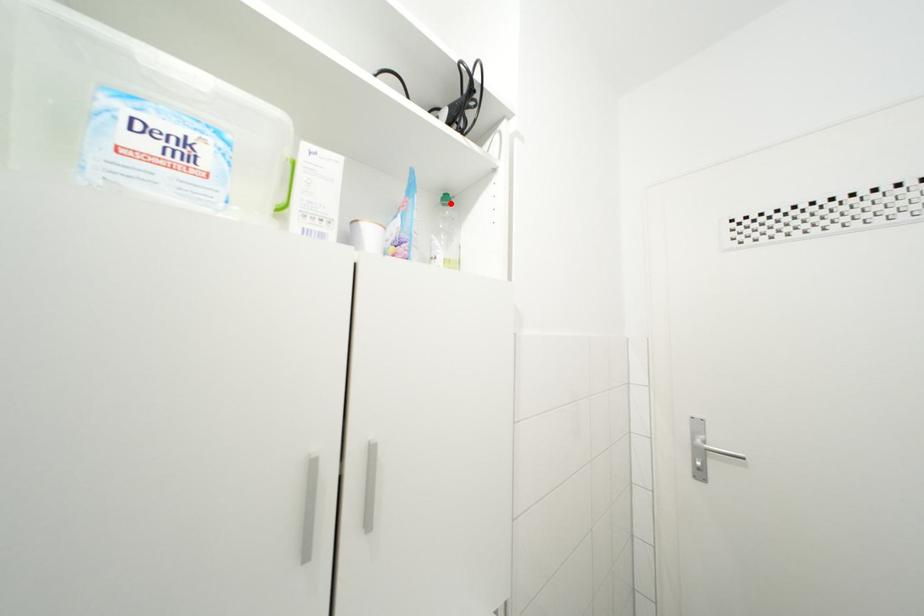
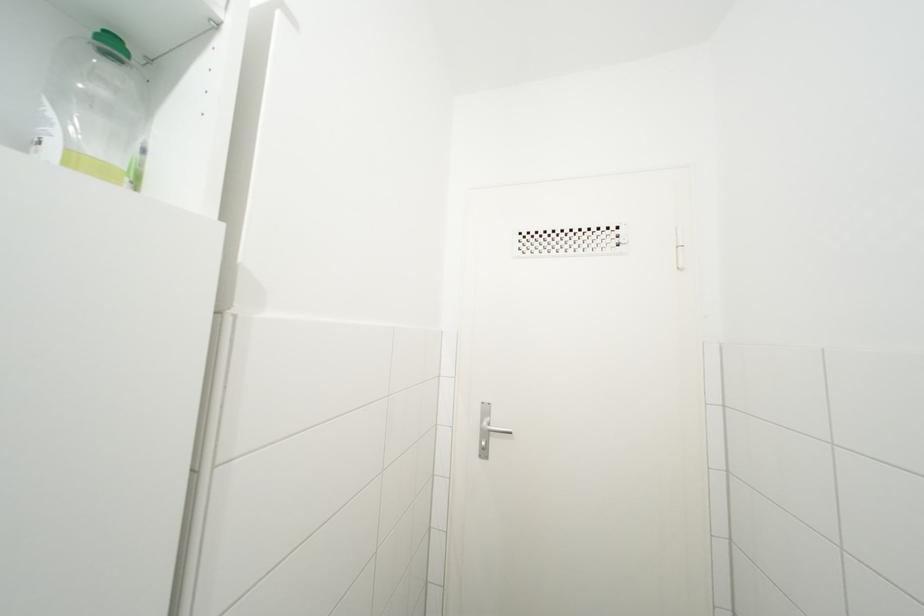
Question: I am providing you with two images of the same scene from different viewpoints. A red point is marked on the first image. Is the red point's position out of view in image 2?

Choices:
 (A) Yes
 (B) No

Answer: (B)